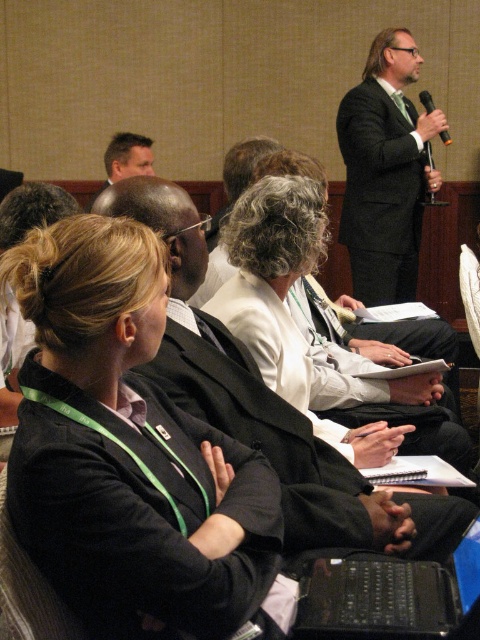
Question: Does dark green textured suit at upper right appear on the right side of black plastic laptop at lower center?

Choices:
 (A) no
 (B) yes

Answer: (B)

Question: Which of the following is the closest to the observer?

Choices:
 (A) (444, 141)
 (B) (113, 166)

Answer: (A)

Question: Can you confirm if black fabric jacket at center is positioned below dark green textured suit at upper right?

Choices:
 (A) yes
 (B) no

Answer: (A)

Question: Among these objects, which one is farthest from the camera?

Choices:
 (A) matte black suit at upper left
 (B) black plastic microphone at upper right

Answer: (A)

Question: Which is farther from the dark green textured suit at upper right?

Choices:
 (A) white shirt at center
 (B) matte black suit at upper left
 (C) black fabric jacket at center
 (D) black plastic microphone at upper right

Answer: (C)

Question: Is dark green textured suit at upper right further to the viewer compared to black plastic microphone at upper right?

Choices:
 (A) yes
 (B) no

Answer: (B)